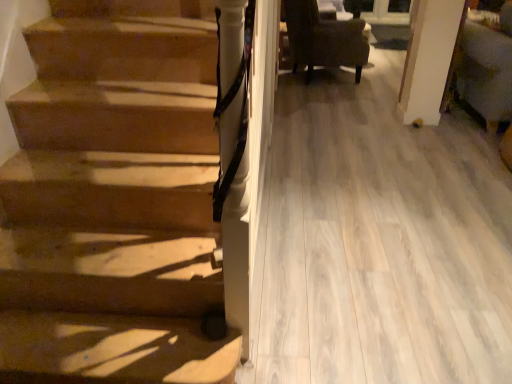
Question: From a real-world perspective, is velvet green armchair at right above or below dark brown fabric chair at upper right?

Choices:
 (A) below
 (B) above

Answer: (B)

Question: From the image's perspective, relative to dark brown fabric chair at upper right, is velvet green armchair at right above or below?

Choices:
 (A) below
 (B) above

Answer: (A)

Question: Visually, is velvet green armchair at right positioned to the left or to the right of dark brown fabric chair at upper right?

Choices:
 (A) right
 (B) left

Answer: (A)

Question: From their relative heights in the image, would you say dark brown fabric chair at upper right is taller or shorter than velvet green armchair at right?

Choices:
 (A) short
 (B) tall

Answer: (A)

Question: Is dark brown fabric chair at upper right situated inside velvet green armchair at right or outside?

Choices:
 (A) inside
 (B) outside

Answer: (B)

Question: In terms of size, does dark brown fabric chair at upper right appear bigger or smaller than velvet green armchair at right?

Choices:
 (A) big
 (B) small

Answer: (B)

Question: From a real-world perspective, is dark brown fabric chair at upper right above or below velvet green armchair at right?

Choices:
 (A) below
 (B) above

Answer: (A)